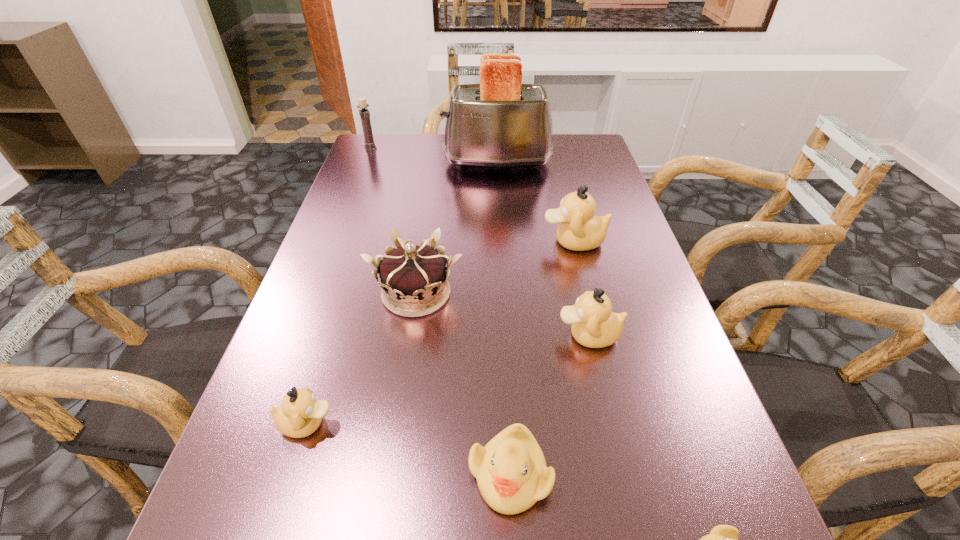
This screenshot has width=960, height=540. Find the location of `free space located 0.050m on the face of the second biggest tan duckling`. free space located 0.050m on the face of the second biggest tan duckling is located at coordinates (530, 335).

In order to click on vacant point located on the face of the second biggest tan duckling in this screenshot , I will do `click(365, 335)`.

Identify the location of free space located on the face of the second biggest tan duckling. (503, 335).

Identify the location of free space located on the face of the nearest tan duckling. (557, 424).

The height and width of the screenshot is (540, 960). I want to click on toaster that is at the far edge, so click(500, 123).

The image size is (960, 540). I want to click on candle holder that is at the far edge, so click(x=364, y=113).

Identify the location of candle holder positioned at the left edge. (364, 113).

Find the location of a particular element. crown at the left edge is located at coordinates (413, 278).

Find the location of a particular element. duckling that is at the left edge is located at coordinates coord(300,415).

This screenshot has width=960, height=540. Identify the location of toaster positioned at the right edge. (500, 123).